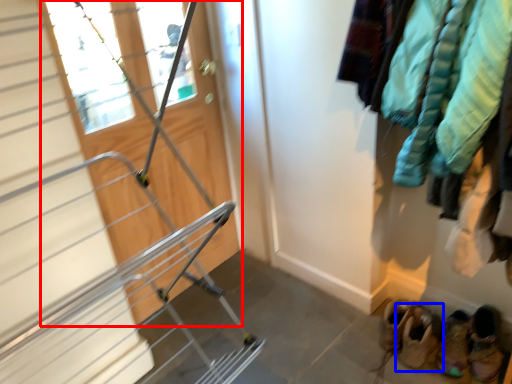
Question: Which object appears closest to the camera in this image, door (highlighted by a red box) or footwear (highlighted by a blue box)?

Choices:
 (A) door
 (B) footwear

Answer: (A)